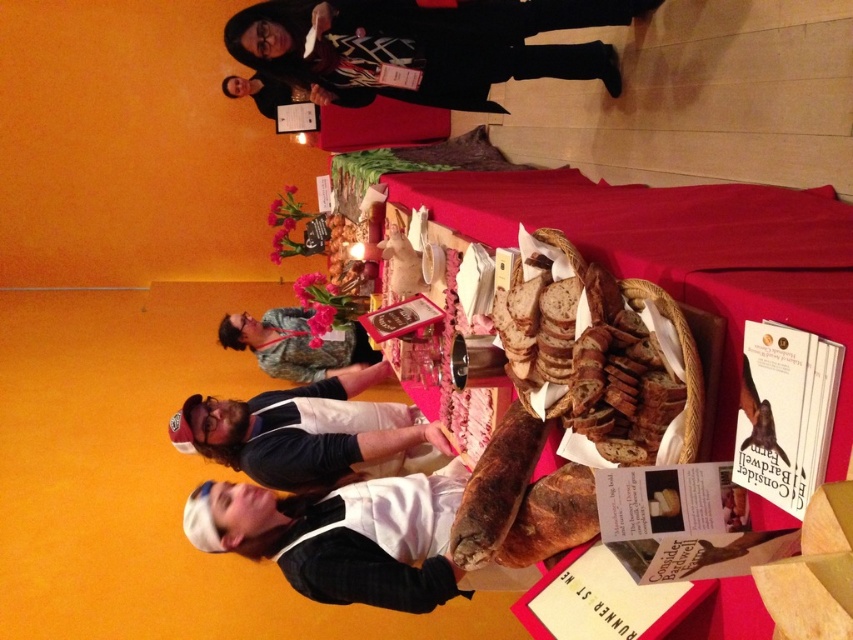
Is matte brown bread basket at center taller than black wool coat at upper center?

Indeed, matte brown bread basket at center has a greater height compared to black wool coat at upper center.

Is matte brown bread basket at center above black wool coat at upper center?

Incorrect, matte brown bread basket at center is not positioned above black wool coat at upper center.

The image size is (853, 640). What do you see at coordinates (682, 253) in the screenshot?
I see `matte brown bread basket at center` at bounding box center [682, 253].

Image resolution: width=853 pixels, height=640 pixels. What are the coordinates of `matte brown bread basket at center` in the screenshot? It's located at (682, 253).

Can you confirm if white fabric apron at lower center is positioned to the left of camouflage fabric shirt at center?

In fact, white fabric apron at lower center is to the right of camouflage fabric shirt at center.

Is white fabric apron at lower center further to the viewer compared to camouflage fabric shirt at center?

No, white fabric apron at lower center is in front of camouflage fabric shirt at center.

Is point (206, 413) positioned after point (224, 344)?

No, (206, 413) is in front of (224, 344).

Image resolution: width=853 pixels, height=640 pixels. Identify the location of white fabric apron at lower center. (311, 433).

Between point (483, 52) and point (277, 376), which one is positioned in front?

Point (483, 52)

Describe the element at coordinates (425, 45) in the screenshot. I see `black wool coat at upper center` at that location.

This screenshot has width=853, height=640. I want to click on black wool coat at upper center, so click(425, 45).